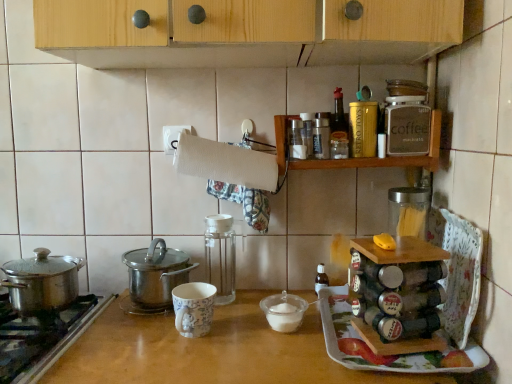
Question: Can you confirm if transparent glass spice rack at center, which is the 3th kitchen appliance from left to right, is shorter than white plastic bowl at center, the 1th appliance viewed from the left?

Choices:
 (A) yes
 (B) no

Answer: (B)

Question: From a real-world perspective, is transparent glass spice rack at center, which is the 3th kitchen appliance from left to right, under white plastic bowl at center, the 1th appliance viewed from the left?

Choices:
 (A) no
 (B) yes

Answer: (A)

Question: Is transparent glass spice rack at center, which is the 5th kitchen appliance in right-to-left order, completely or partially outside of white plastic bowl at center, the 2th appliance positioned from the right?

Choices:
 (A) yes
 (B) no

Answer: (A)

Question: Considering the relative sizes of transparent glass spice rack at center, which is the 3th kitchen appliance from left to right, and white plastic bowl at center, the 2th appliance positioned from the right, in the image provided, is transparent glass spice rack at center, which is the 3th kitchen appliance from left to right, smaller than white plastic bowl at center, the 2th appliance positioned from the right,?

Choices:
 (A) no
 (B) yes

Answer: (A)

Question: Is wooden spice rack at upper right in front of or behind transparent glass spice rack at center, which is the 5th kitchen appliance in right-to-left order, in the image?

Choices:
 (A) front
 (B) behind

Answer: (A)

Question: From their relative heights in the image, would you say wooden spice rack at upper right is taller or shorter than transparent glass spice rack at center, which is the 3th kitchen appliance from left to right?

Choices:
 (A) tall
 (B) short

Answer: (B)

Question: Is point (338, 167) closer or farther from the camera than point (215, 233)?

Choices:
 (A) closer
 (B) farther

Answer: (A)

Question: Choose the correct answer: Is wooden spice rack at upper right inside transparent glass spice rack at center, which is the 5th kitchen appliance in right-to-left order, or outside it?

Choices:
 (A) inside
 (B) outside

Answer: (B)

Question: From a real-world perspective, is shiny metallic pot at left, positioned as the sixth kitchen appliance in right-to-left order, physically located above or below metallic silver spice rack at center right, which ranks as the second appliance in left-to-right order?

Choices:
 (A) below
 (B) above

Answer: (A)

Question: Which is correct: shiny metallic pot at left, marked as the second kitchen appliance in a left-to-right arrangement, is inside metallic silver spice rack at center right, the first appliance when ordered from right to left, or outside of it?

Choices:
 (A) inside
 (B) outside

Answer: (B)

Question: Is point (140, 276) closer or farther from the camera than point (368, 291)?

Choices:
 (A) closer
 (B) farther

Answer: (B)

Question: Is shiny metallic pot at left, marked as the second kitchen appliance in a left-to-right arrangement, in front of or behind metallic silver spice rack at center right, which ranks as the second appliance in left-to-right order, in the image?

Choices:
 (A) front
 (B) behind

Answer: (B)

Question: Is metallic glass spice rack at upper center, which ranks as the 4th kitchen appliance in left-to-right order, wider or thinner than white plastic bowl at center, the 1th appliance viewed from the left?

Choices:
 (A) wide
 (B) thin

Answer: (B)

Question: In terms of height, does metallic glass spice rack at upper center, which ranks as the 4th kitchen appliance in left-to-right order, look taller or shorter compared to white plastic bowl at center, the 1th appliance viewed from the left?

Choices:
 (A) short
 (B) tall

Answer: (B)